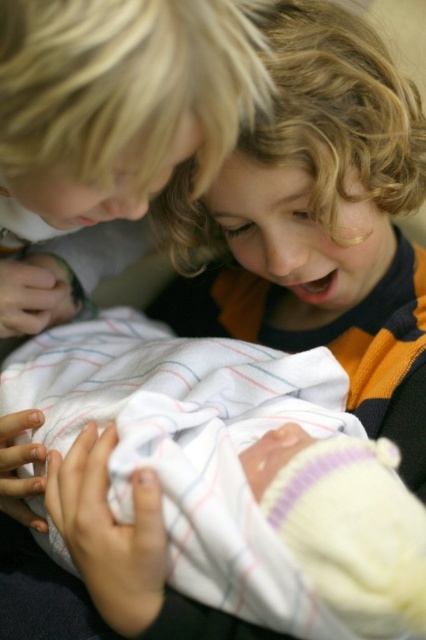
The image size is (426, 640). What do you see at coordinates (229, 465) in the screenshot?
I see `white soft swaddling blanket at center` at bounding box center [229, 465].

Which is in front, point (351, 461) or point (97, 104)?

Point (97, 104)

The height and width of the screenshot is (640, 426). What do you see at coordinates (229, 465) in the screenshot?
I see `white soft swaddling blanket at center` at bounding box center [229, 465].

The height and width of the screenshot is (640, 426). Identify the location of white soft swaddling blanket at center. (229, 465).